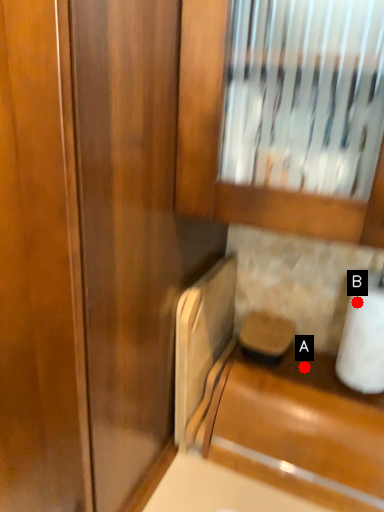
Question: Two points are circled on the image, labeled by A and B beside each circle. Which point is closer to the camera?

Choices:
 (A) A is closer
 (B) B is closer

Answer: (B)